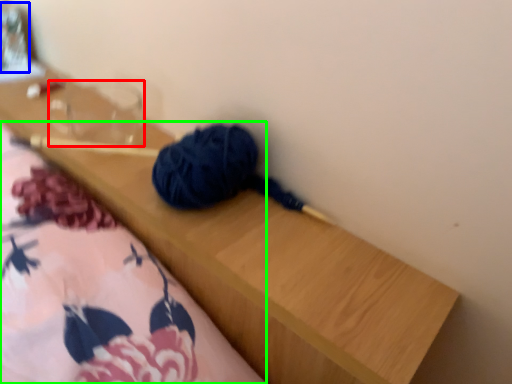
Question: Which object is the closest to the clear (highlighted by a red box)? Choose among these: glass jar (highlighted by a blue box) or blanket (highlighted by a green box).

Choices:
 (A) glass jar
 (B) blanket

Answer: (A)